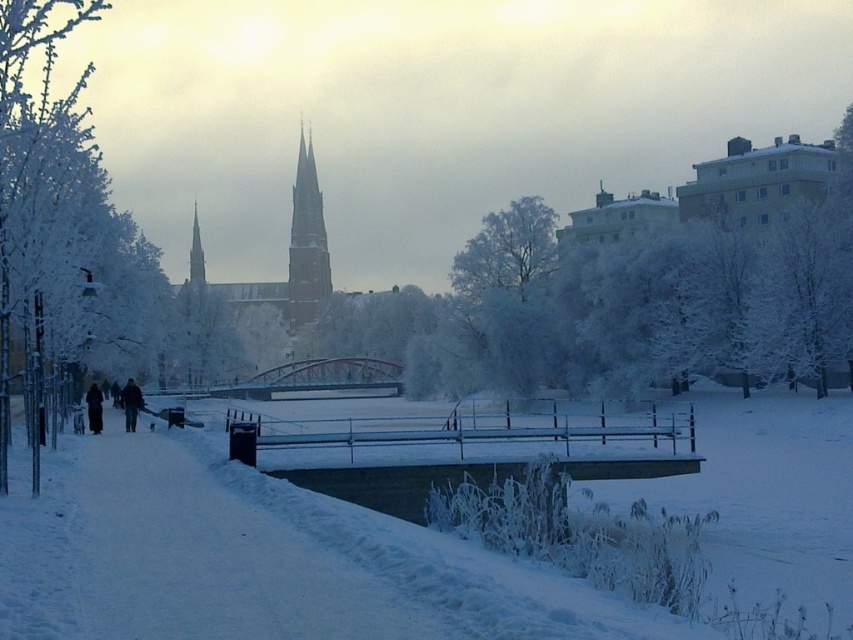
Question: Among these objects, which one is farthest from the camera?

Choices:
 (A) dark gray woolen coat at lower left
 (B) white frosty tree at center
 (C) black matte coat at left

Answer: (B)

Question: Which point is closer to the camera?

Choices:
 (A) (x=126, y=397)
 (B) (x=347, y=358)
 (C) (x=93, y=429)
 (D) (x=664, y=330)

Answer: (C)

Question: Is smooth stone tower at center thinner than dark gray woolen coat at lower left?

Choices:
 (A) yes
 (B) no

Answer: (A)

Question: Does white frosted tree at left appear over black matte coat at left?

Choices:
 (A) yes
 (B) no

Answer: (A)

Question: Does smooth stone tower at center have a lesser width compared to black matte coat at left?

Choices:
 (A) no
 (B) yes

Answer: (B)

Question: Which point appears farthest from the camera in this image?

Choices:
 (A) (109, 600)
 (B) (61, 259)
 (C) (848, 122)

Answer: (C)